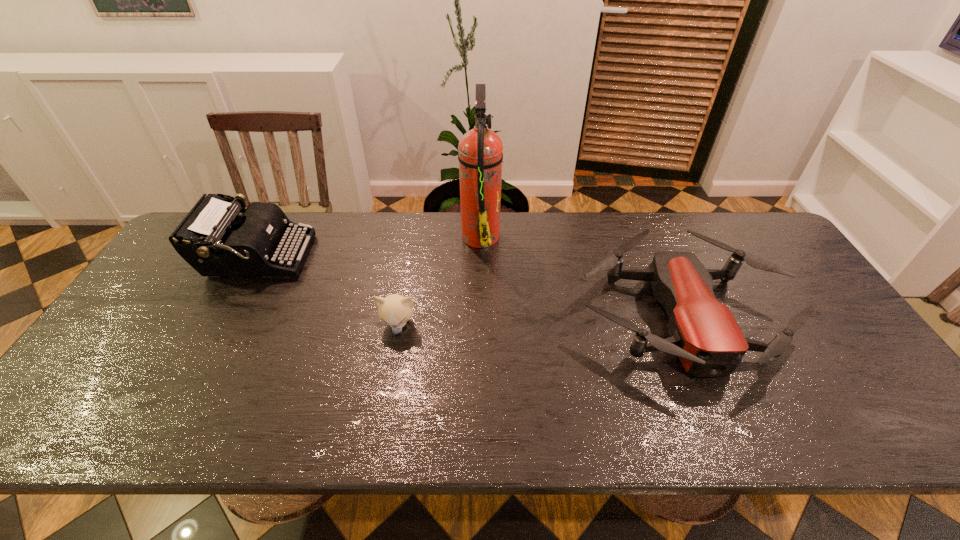
Find the location of a particular element. free spot between the drone and the leftmost object is located at coordinates (469, 286).

The width and height of the screenshot is (960, 540). I want to click on empty space that is in between the third object from right to left and the drone, so click(x=540, y=320).

Image resolution: width=960 pixels, height=540 pixels. Identify the location of empty space that is in between the tallest object and the rightmost object. click(581, 275).

You are a GUI agent. You are given a task and a screenshot of the screen. Output one action in this format:
    pyautogui.click(x=<x>, y=<y>)
    Task: Click on the vacant area that lies between the second object from left to right and the typewriter
    
    Given the screenshot: What is the action you would take?
    pyautogui.click(x=327, y=291)

The height and width of the screenshot is (540, 960). Find the location of `the closest object to the typewriter`. the closest object to the typewriter is located at coordinates (395, 310).

Where is `the second closest object relative to the rightmost object`? The width and height of the screenshot is (960, 540). the second closest object relative to the rightmost object is located at coordinates (395, 310).

Image resolution: width=960 pixels, height=540 pixels. In order to click on blank space that satisfies the following two spatial constraints: 1. at the nozzle of the fire extinguisher; 2. on the face of the third object from right to left in this screenshot , I will do `click(481, 325)`.

Image resolution: width=960 pixels, height=540 pixels. I want to click on vacant space that satisfies the following two spatial constraints: 1. at the nozzle of the tallest object; 2. on the face of the kitten, so click(481, 325).